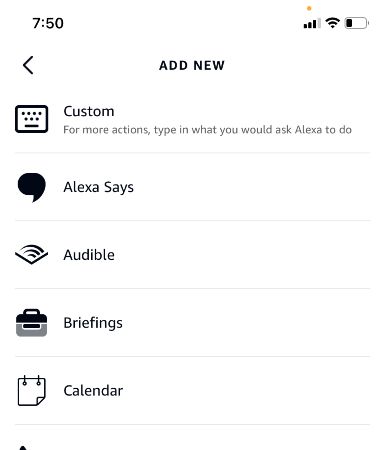
Find the location of a particular element. This screenshot has height=450, width=385. wifi is located at coordinates point(339,18).